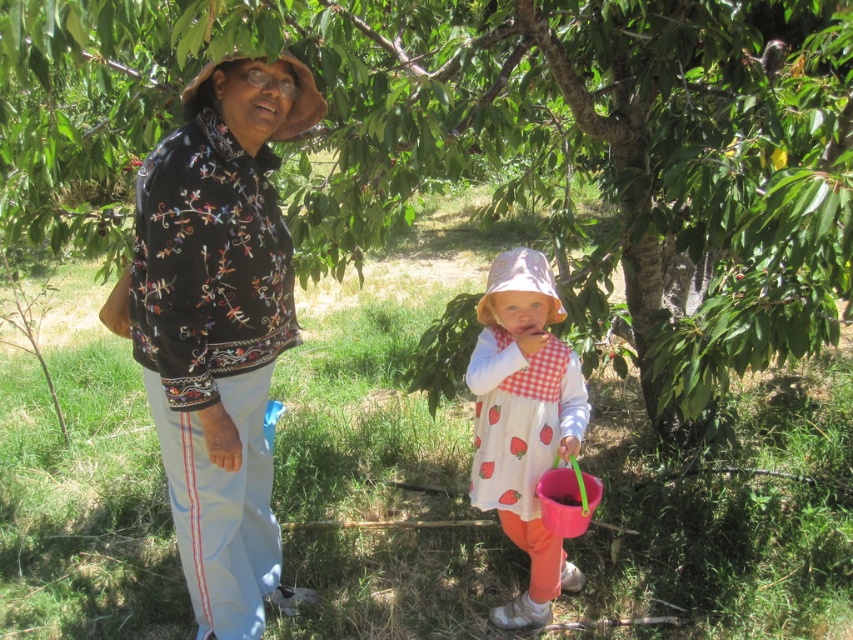
Question: Does green leafy tree at center lie behind white cotton dress with strawberry print at center?

Choices:
 (A) no
 (B) yes

Answer: (A)

Question: Which of the following is the farthest from the observer?

Choices:
 (A) white cotton dress with strawberry print at center
 (B) green leafy tree at center

Answer: (A)

Question: Which point appears farthest from the camera in this image?

Choices:
 (A) (216, 285)
 (B) (711, 141)
 (C) (548, 417)

Answer: (B)

Question: Estimate the real-world distances between objects in this image. Which object is closer to the embroidered cotton jacket at center?

Choices:
 (A) white cotton dress with strawberry print at center
 (B) green leafy tree at center

Answer: (A)

Question: Is green leafy tree at center further to the viewer compared to embroidered cotton jacket at center?

Choices:
 (A) yes
 (B) no

Answer: (B)

Question: Is embroidered cotton jacket at center closer to camera compared to white cotton dress with strawberry print at center?

Choices:
 (A) yes
 (B) no

Answer: (A)